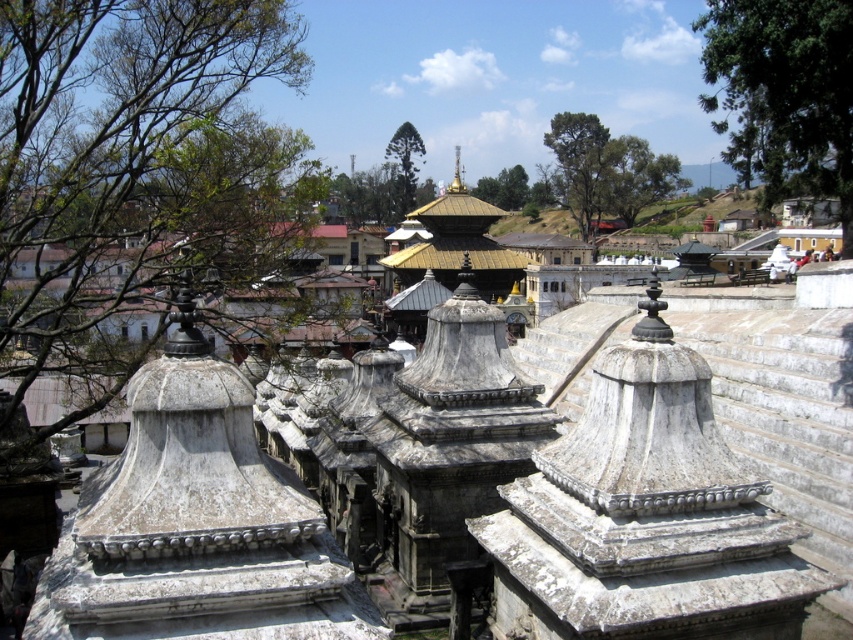
Question: Is green leafy tree at upper left bigger than green textured tree at center?

Choices:
 (A) no
 (B) yes

Answer: (B)

Question: Can you confirm if green leafy tree at upper right is thinner than green textured tree at center?

Choices:
 (A) no
 (B) yes

Answer: (A)

Question: Which object is closer to the camera taking this photo?

Choices:
 (A) green leafy tree at upper left
 (B) green leafy tree at upper right
 (C) green textured tree at center

Answer: (A)

Question: Among these objects, which one is farthest from the camera?

Choices:
 (A) green leafy tree at upper left
 (B) green textured tree at center

Answer: (B)

Question: Is green leafy tree at upper left in front of green leafy tree at upper right?

Choices:
 (A) yes
 (B) no

Answer: (A)

Question: Which of the following is the closest to the observer?

Choices:
 (A) (405, 195)
 (B) (28, 49)

Answer: (B)